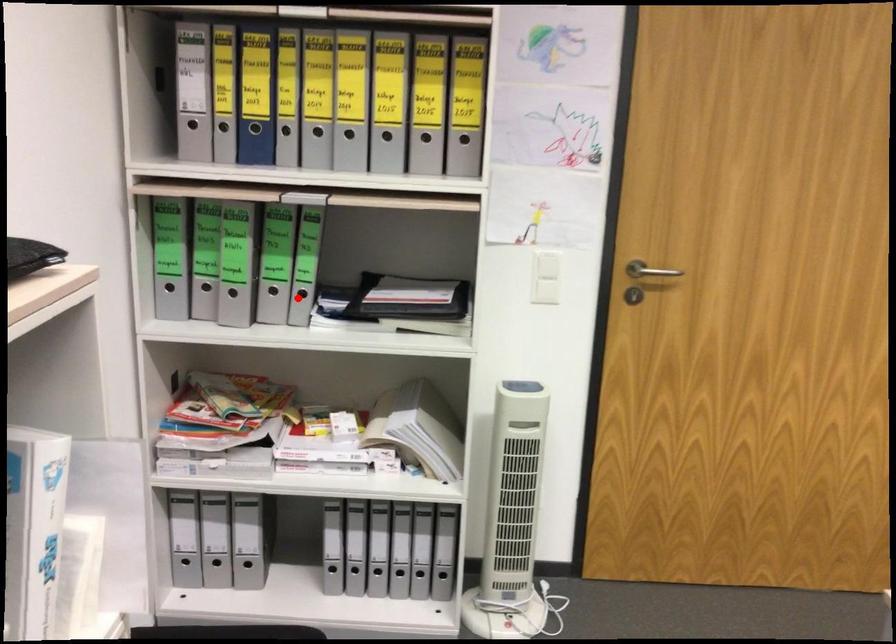
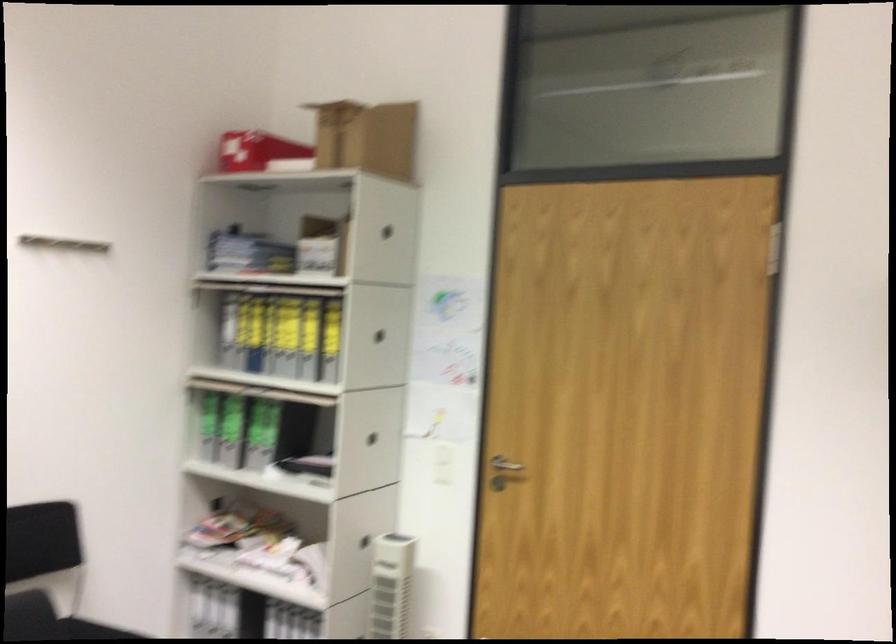
Question: I am providing you with two images of the same scene from different viewpoints. Image1 has a red point marked. In image2, the corresponding 3D location appears at what relative position? Reply with the corresponding letter.

Choices:
 (A) Closer
 (B) Farther

Answer: (B)